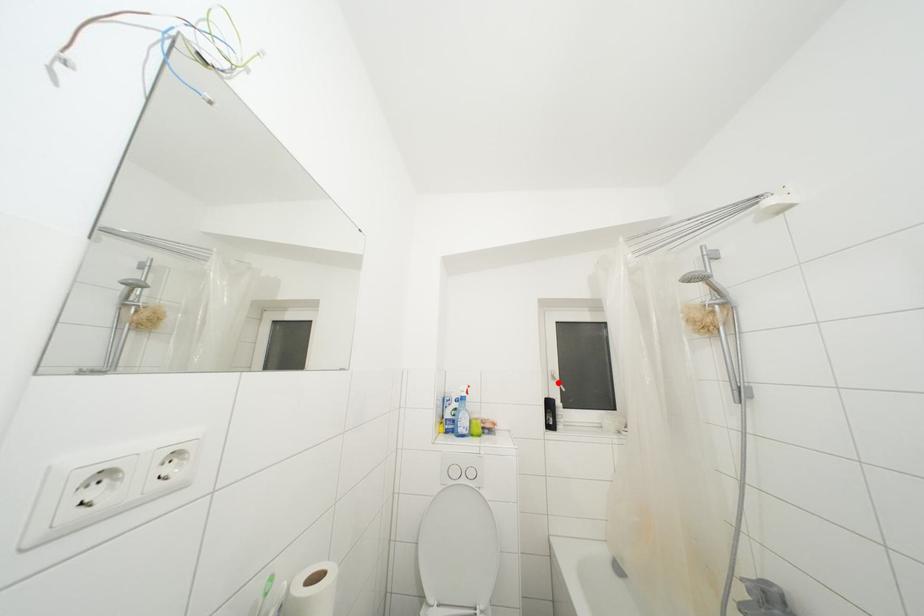
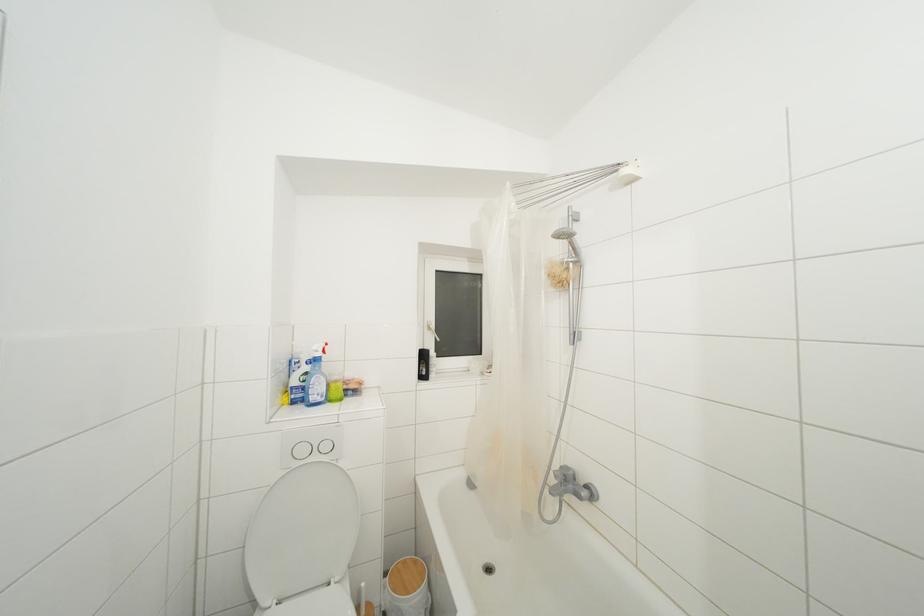
In the second image, find the point that corresponds to the highlighted location in the first image.

(433, 333)